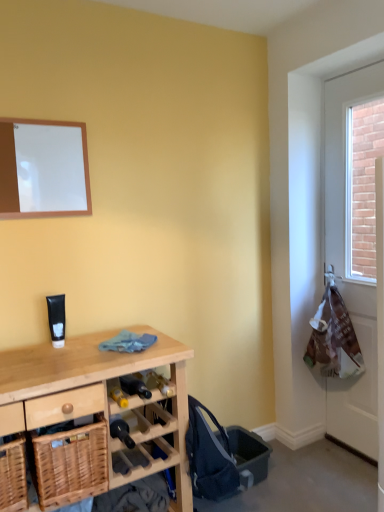
Question: Does point (74, 164) appear closer or farther from the camera than point (109, 352)?

Choices:
 (A) closer
 (B) farther

Answer: (B)

Question: Would you say white matte board at upper left is to the left or to the right of wooden desk at lower left in the picture?

Choices:
 (A) left
 (B) right

Answer: (A)

Question: Based on their relative distances, which object is nearer to the white plastic bag at right?

Choices:
 (A) white matte board at upper left
 (B) woven wood basket at lower left, which ranks as the 2th basket in left-to-right order
 (C) woven wood basket at lower left, the 2th basket in the right-to-left sequence
 (D) wooden desk at lower left

Answer: (D)

Question: Estimate the real-world distances between objects in this image. Which object is closer to the white plastic bag at right?

Choices:
 (A) white matte board at upper left
 (B) woven wood basket at lower left, which ranks as the first basket in right-to-left order
 (C) woven wood basket at lower left, acting as the first basket starting from the left
 (D) wooden desk at lower left

Answer: (D)